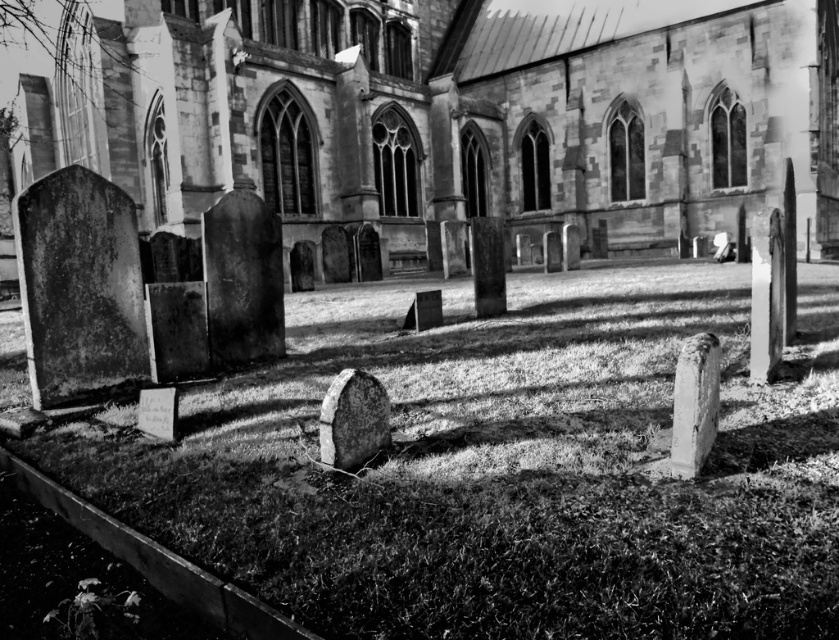
Can you confirm if smooth stone gravestone at lower right is shorter than rough stone gravestone at center?

No.

Is point (707, 346) more distant than point (318, 416)?

No, (707, 346) is closer to viewer.

Between point (715, 406) and point (326, 460), which one is positioned in front?

Point (715, 406) is more forward.

I want to click on smooth stone gravestone at lower right, so click(x=694, y=403).

Is smooth stone church at center below smooth stone gravestone at lower right?

Incorrect, smooth stone church at center is not positioned below smooth stone gravestone at lower right.

Is point (308, 129) farther from camera compared to point (690, 419)?

Yes, it is behind point (690, 419).

Locate an element on the screen. The image size is (839, 640). smooth stone church at center is located at coordinates (443, 112).

Who is more forward, (446, 58) or (373, 456)?

Point (373, 456) is more forward.

Is smooth stone church at center positioned before rough stone gravestone at center?

No, it is behind rough stone gravestone at center.

Is point (294, 196) positioned before point (367, 410)?

No, it is behind (367, 410).

The image size is (839, 640). I want to click on smooth stone church at center, so click(443, 112).